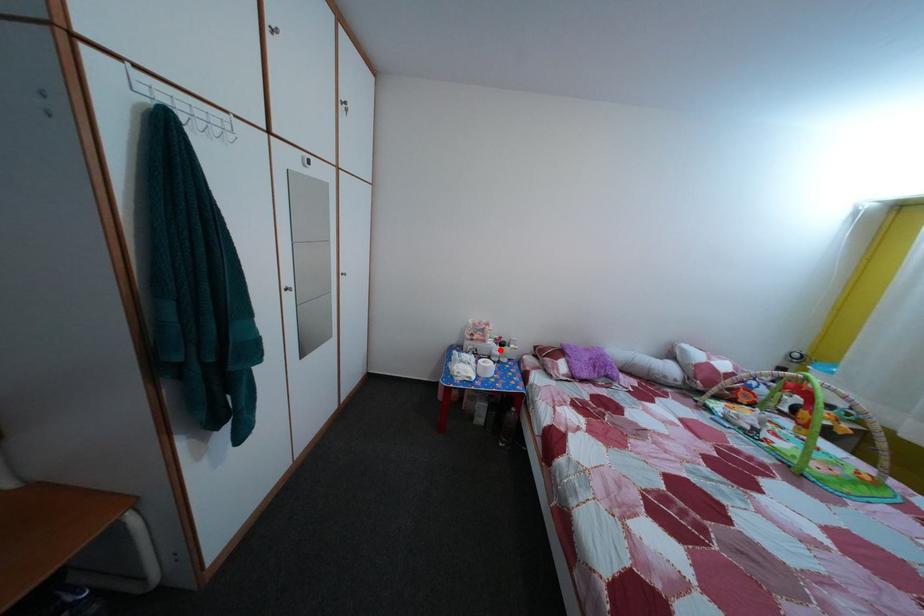
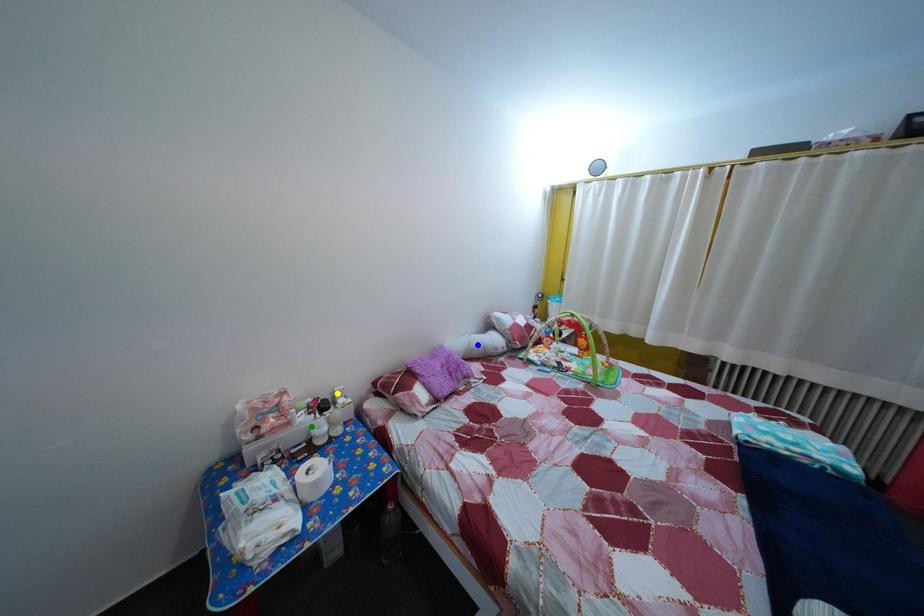
Question: I am providing you with two images of the same scene from different viewpoints. A red point is marked on the first image. You are given multiple points on the second image. Which point in image 2 represents the same 3d spot as the red point in image 1?

Choices:
 (A) green point
 (B) yellow point
 (C) blue point

Answer: (A)